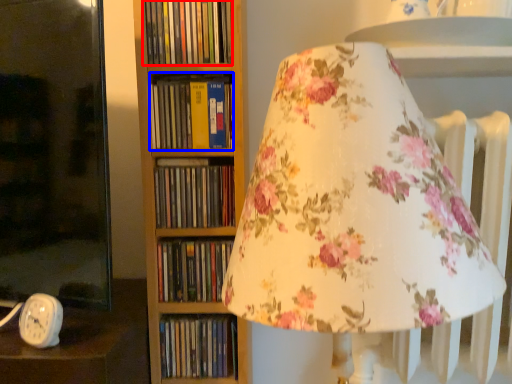
Question: Which object is closer to the camera taking this photo, book (highlighted by a red box) or book (highlighted by a blue box)?

Choices:
 (A) book
 (B) book

Answer: (A)